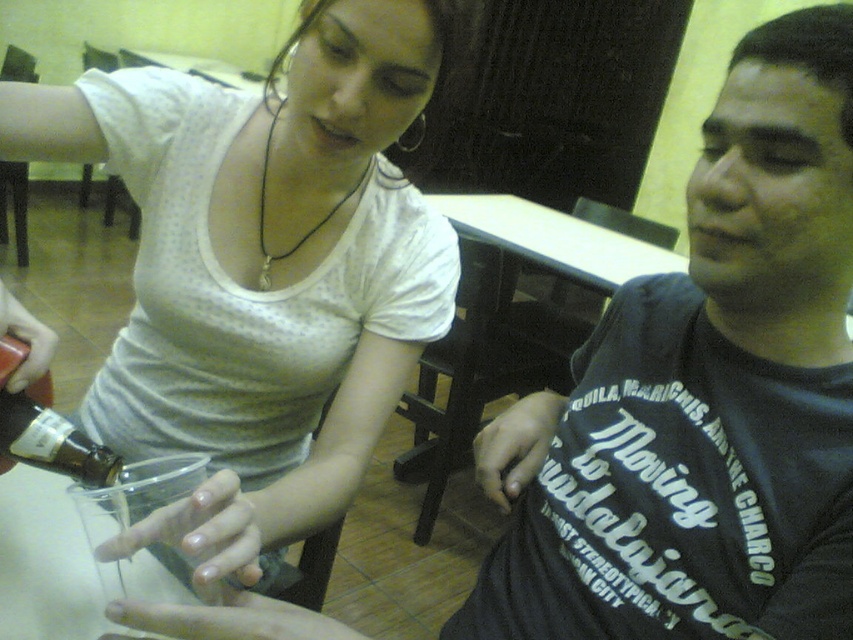
Between point (433, 332) and point (468, 358), which one is positioned in front?

Positioned in front is point (433, 332).

Measure the distance between matte white shirt at upper left and white plastic table at center.

matte white shirt at upper left is 1.16 meters away from white plastic table at center.

This screenshot has height=640, width=853. In order to click on matte white shirt at upper left in this screenshot , I will do `click(264, 264)`.

Who is lower down, white plastic table at center or matte glass bottle at lower left?

matte glass bottle at lower left is below.

Does point (451, 198) come in front of point (38, 428)?

No, it is behind (38, 428).

The image size is (853, 640). Identify the location of white plastic table at center. click(505, 324).

Can you confirm if matte white shirt at upper left is shorter than matte glass bottle at lower left?

No, matte white shirt at upper left is not shorter than matte glass bottle at lower left.

The image size is (853, 640). Describe the element at coordinates (264, 264) in the screenshot. I see `matte white shirt at upper left` at that location.

Find the location of a particular element. The width and height of the screenshot is (853, 640). matte white shirt at upper left is located at coordinates (264, 264).